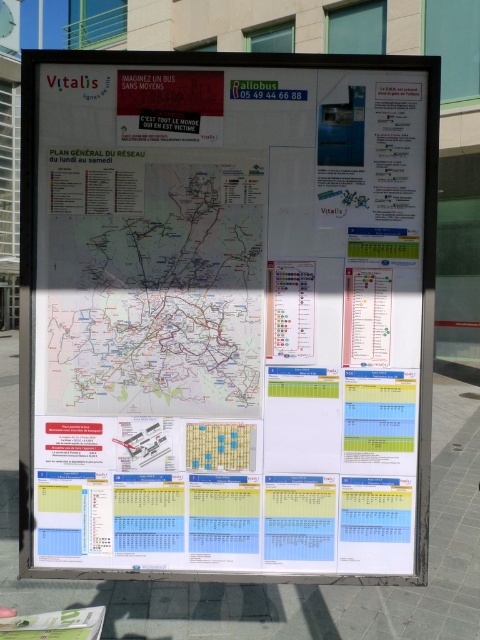
Is white paperboard at center to the left of white paper map at center from the viewer's perspective?

No, white paperboard at center is not to the left of white paper map at center.

Can you confirm if white paperboard at center is positioned below white paper map at center?

Yes.

The height and width of the screenshot is (640, 480). What are the coordinates of `white paperboard at center` in the screenshot? It's located at (227, 314).